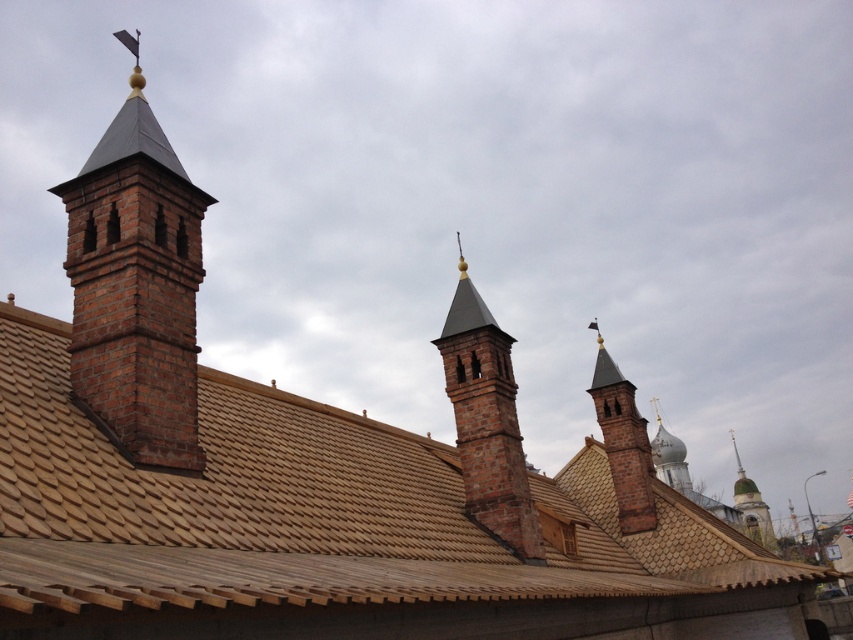
Question: Which object is closer to the camera taking this photo?

Choices:
 (A) brick chimney at left
 (B) greenish stone tower at right

Answer: (A)

Question: Is brick chimney at left further to the viewer compared to brick chimney at upper right?

Choices:
 (A) yes
 (B) no

Answer: (B)

Question: Which object is the closest to the brick chimney at upper right?

Choices:
 (A) brown brick chimney at center
 (B) brick chimney at left

Answer: (A)

Question: Which point appears farthest from the camera in this image?

Choices:
 (A) (142, 428)
 (B) (650, 500)

Answer: (B)

Question: Observing the image, what is the correct spatial positioning of brown brick chimney at center in reference to greenish stone tower at right?

Choices:
 (A) right
 (B) left

Answer: (B)

Question: Where is brick chimney at left located in relation to brown brick chimney at center in the image?

Choices:
 (A) right
 (B) left

Answer: (B)